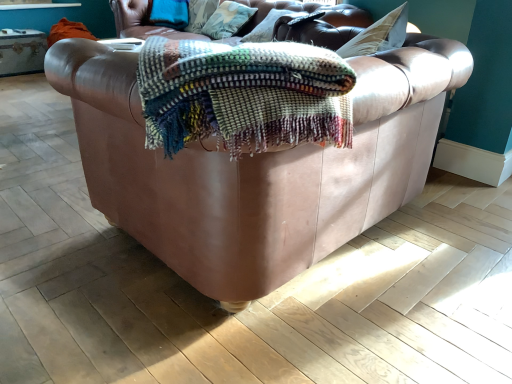
You are a GUI agent. You are given a task and a screenshot of the screen. Output one action in this format:
    pyautogui.click(x=<x>, y=<y>)
    Task: Click on the leather couch at center
    The height and width of the screenshot is (384, 512).
    Given the screenshot: What is the action you would take?
    pos(257,168)

I want to click on pillow located in front of the textured cotton pillow at upper center, acting as the first pillow starting from the left, so click(x=266, y=27).

Looking at this image, is textured cotton pillow at upper center, acting as the first pillow starting from the left, not within velvet cushion at upper center, the second pillow in the left-to-right sequence?

textured cotton pillow at upper center, acting as the first pillow starting from the left, is positioned outside velvet cushion at upper center, the second pillow in the left-to-right sequence.

From a real-world perspective, which is physically below, textured cotton pillow at upper center, acting as the first pillow starting from the left, or velvet cushion at upper center, the 1th pillow from the right?

textured cotton pillow at upper center, acting as the first pillow starting from the left, from a real-world perspective.

In terms of width, does textured cotton pillow at upper center, acting as the first pillow starting from the left, look wider or thinner when compared to velvet cushion at upper center, the 1th pillow from the right?

textured cotton pillow at upper center, acting as the first pillow starting from the left, is thinner than velvet cushion at upper center, the 1th pillow from the right.

Is velvet cushion at upper center, the 1th pillow from the right, placed right next to textured cotton pillow at upper center, acting as the first pillow starting from the left?

No, velvet cushion at upper center, the 1th pillow from the right, is not touching textured cotton pillow at upper center, acting as the first pillow starting from the left.

Is velvet cushion at upper center, the 1th pillow from the right, at the left side of textured cotton pillow at upper center, acting as the first pillow starting from the left?

In fact, velvet cushion at upper center, the 1th pillow from the right, is to the right of textured cotton pillow at upper center, acting as the first pillow starting from the left.

Can you confirm if velvet cushion at upper center, the second pillow in the left-to-right sequence, is bigger than textured cotton pillow at upper center, acting as the first pillow starting from the left?

Yes, velvet cushion at upper center, the second pillow in the left-to-right sequence, is bigger than textured cotton pillow at upper center, acting as the first pillow starting from the left.

Which object is closer to the camera taking this photo, velvet cushion at upper center, the second pillow in the left-to-right sequence, or textured cotton pillow at upper center, which is counted as the second pillow, starting from the right?

velvet cushion at upper center, the second pillow in the left-to-right sequence, is more forward.

Is leather couch at center closer to the viewer compared to textured cotton pillow at upper center, which is counted as the second pillow, starting from the right?

Yes, the depth of leather couch at center is less than that of textured cotton pillow at upper center, which is counted as the second pillow, starting from the right.

Consider the image. Is leather couch at center to the left or to the right of textured cotton pillow at upper center, acting as the first pillow starting from the left, in the image?

Based on their positions, leather couch at center is located to the right of textured cotton pillow at upper center, acting as the first pillow starting from the left.

Is leather couch at center bigger or smaller than textured cotton pillow at upper center, which is counted as the second pillow, starting from the right?

Considering their sizes, leather couch at center takes up more space than textured cotton pillow at upper center, which is counted as the second pillow, starting from the right.

Which of these two, velvet cushion at upper center, the 1th pillow from the right, or leather couch at center, is smaller?

Smaller between the two is velvet cushion at upper center, the 1th pillow from the right.

From the image's perspective, which is above, velvet cushion at upper center, the 1th pillow from the right, or leather couch at center?

From the image's view, velvet cushion at upper center, the 1th pillow from the right, is above.

How many degrees apart are the facing directions of velvet cushion at upper center, the 1th pillow from the right, and leather couch at center?

The facing directions of velvet cushion at upper center, the 1th pillow from the right, and leather couch at center are 87 degrees apart.

Does point (273, 24) come closer to viewer compared to point (190, 241)?

No, it is behind (190, 241).

Is point (213, 24) closer to viewer compared to point (133, 234)?

No, (213, 24) is behind (133, 234).

From a real-world perspective, relative to leather couch at center, is textured cotton pillow at upper center, acting as the first pillow starting from the left, vertically above or below?

From a real-world perspective, textured cotton pillow at upper center, acting as the first pillow starting from the left, is physically above leather couch at center.

Does textured cotton pillow at upper center, which is counted as the second pillow, starting from the right, have a smaller size compared to leather couch at center?

Yes.

From the picture: Which is in front, textured cotton pillow at upper center, which is counted as the second pillow, starting from the right, or leather couch at center?

leather couch at center is closer to the camera.

From a real-world perspective, which is physically above, leather couch at center or velvet cushion at upper center, the second pillow in the left-to-right sequence?

velvet cushion at upper center, the second pillow in the left-to-right sequence, is physically above.

Which is behind, point (329, 176) or point (278, 19)?

Point (278, 19)

How much distance is there between leather couch at center and velvet cushion at upper center, the second pillow in the left-to-right sequence?

leather couch at center is 1.14 meters from velvet cushion at upper center, the second pillow in the left-to-right sequence.

Is leather couch at center surrounding velvet cushion at upper center, the second pillow in the left-to-right sequence?

That's incorrect, velvet cushion at upper center, the second pillow in the left-to-right sequence, is not inside leather couch at center.

In order to click on pillow behind the velvet cushion at upper center, the second pillow in the left-to-right sequence in this screenshot , I will do `click(227, 20)`.

The width and height of the screenshot is (512, 384). What are the coordinates of `pillow located underneath the velvet cushion at upper center, the 1th pillow from the right (from a real-world perspective)` in the screenshot? It's located at (227, 20).

Which object lies nearer to the anchor point textured cotton pillow at upper center, which is counted as the second pillow, starting from the right, leather couch at center or velvet cushion at upper center, the second pillow in the left-to-right sequence?

Based on the image, velvet cushion at upper center, the second pillow in the left-to-right sequence, appears to be nearer to textured cotton pillow at upper center, which is counted as the second pillow, starting from the right.

From the image, which object appears to be farther from textured cotton pillow at upper center, which is counted as the second pillow, starting from the right, velvet cushion at upper center, the second pillow in the left-to-right sequence, or leather couch at center?

leather couch at center.

From the image, which object appears to be farther from leather couch at center, velvet cushion at upper center, the second pillow in the left-to-right sequence, or textured cotton pillow at upper center, acting as the first pillow starting from the left?

textured cotton pillow at upper center, acting as the first pillow starting from the left, lies further to leather couch at center than the other object.

Consider the image. Based on their spatial positions, is leather couch at center or textured cotton pillow at upper center, which is counted as the second pillow, starting from the right, closer to velvet cushion at upper center, the second pillow in the left-to-right sequence?

Among the two, textured cotton pillow at upper center, which is counted as the second pillow, starting from the right, is located nearer to velvet cushion at upper center, the second pillow in the left-to-right sequence.

When comparing their distances from leather couch at center, does textured cotton pillow at upper center, which is counted as the second pillow, starting from the right, or velvet cushion at upper center, the second pillow in the left-to-right sequence, seem further?

textured cotton pillow at upper center, which is counted as the second pillow, starting from the right, is positioned further to the anchor leather couch at center.

Which object lies nearer to the anchor point velvet cushion at upper center, the 1th pillow from the right, textured cotton pillow at upper center, which is counted as the second pillow, starting from the right, or leather couch at center?

textured cotton pillow at upper center, which is counted as the second pillow, starting from the right, is positioned closer to the anchor velvet cushion at upper center, the 1th pillow from the right.

Where is `pillow positioned between leather couch at center and textured cotton pillow at upper center, which is counted as the second pillow, starting from the right, from near to far`? pillow positioned between leather couch at center and textured cotton pillow at upper center, which is counted as the second pillow, starting from the right, from near to far is located at coordinates (266, 27).